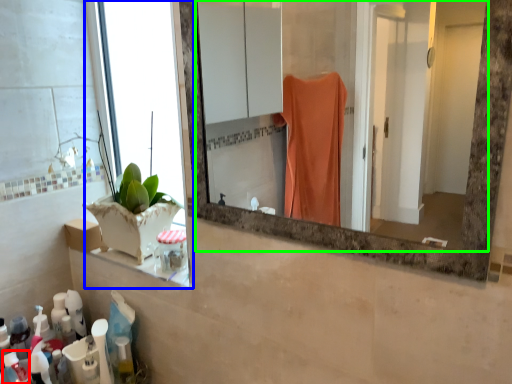
Question: Which is nearer to the toiletry (highlighted by a red box)? window (highlighted by a blue box) or mirror (highlighted by a green box).

Choices:
 (A) window
 (B) mirror

Answer: (A)